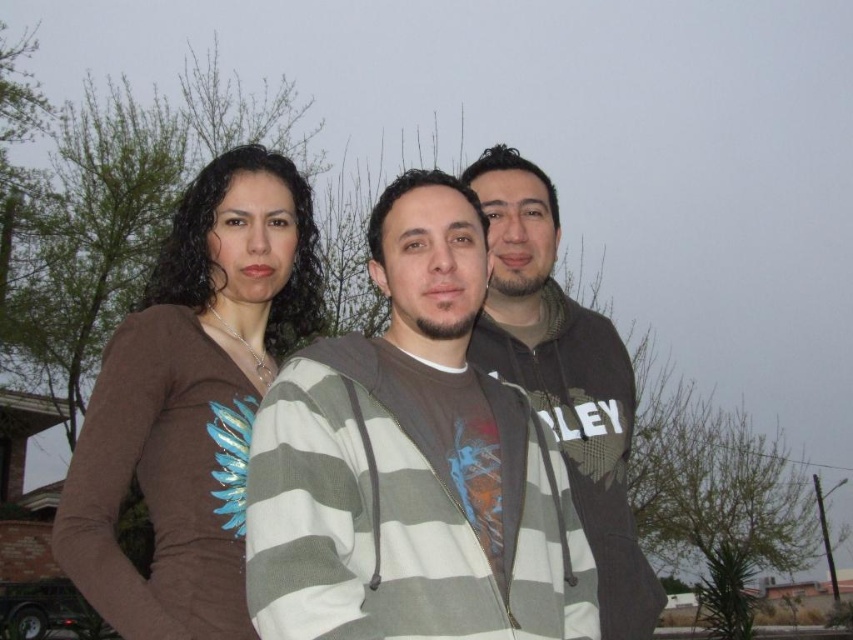
You are a photographer adjusting the camera settings to focus on the brown matte shirt at left. What are the coordinates where you should aim the camera?

The coordinates to aim the camera are at point (190, 401).